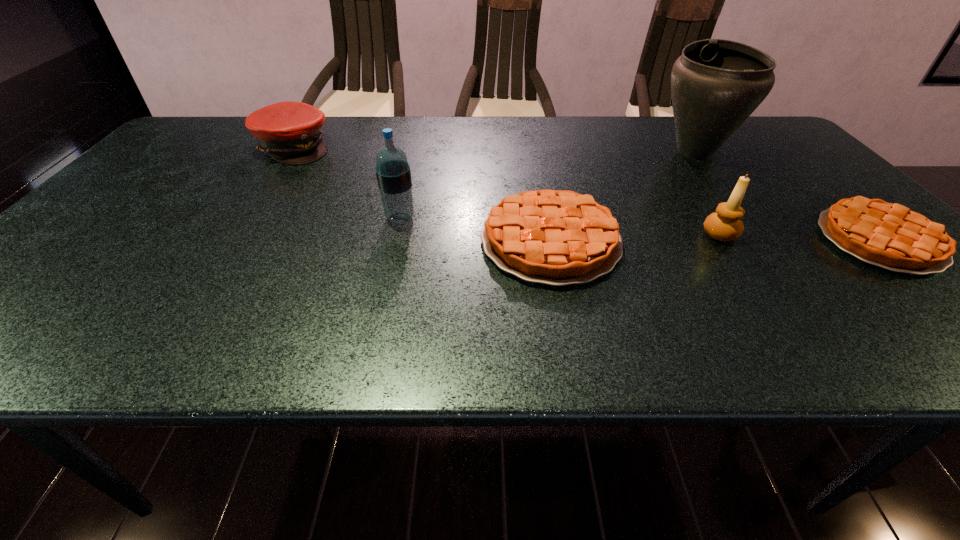
This screenshot has width=960, height=540. What are the coordinates of `vacant space situated 0.280m on the left of the fifth shortest object` in the screenshot? It's located at tap(266, 218).

The image size is (960, 540). What are the coordinates of `vacant space located at the front of the leftmost object where the visor is located` in the screenshot? It's located at (371, 147).

You are a GUI agent. You are given a task and a screenshot of the screen. Output one action in this format:
    pyautogui.click(x=<x>, y=<y>)
    Task: Click on the vacant space located 0.170m on the right of the candle_holder
    The height and width of the screenshot is (540, 960).
    Given the screenshot: What is the action you would take?
    pyautogui.click(x=813, y=235)

The image size is (960, 540). I want to click on urn that is at the far edge, so [x=716, y=84].

Find the location of a particular element. The image size is (960, 540). cap located at the far edge is located at coordinates (289, 132).

Locate an element on the screen. object that is at the near edge is located at coordinates (558, 238).

Identify the location of vacant space at the far edge. [x=374, y=141].

At what (x,y) coordinates should I click in order to perform the action: click on blank space at the near edge of the desktop. Please return your answer as a coordinate pair (x, y). The image size is (960, 540). Looking at the image, I should click on (820, 298).

Find the location of a particular element. free region at the left edge is located at coordinates point(153,179).

What are the coordinates of `vacant space at the right edge of the desktop` in the screenshot? It's located at (793, 194).